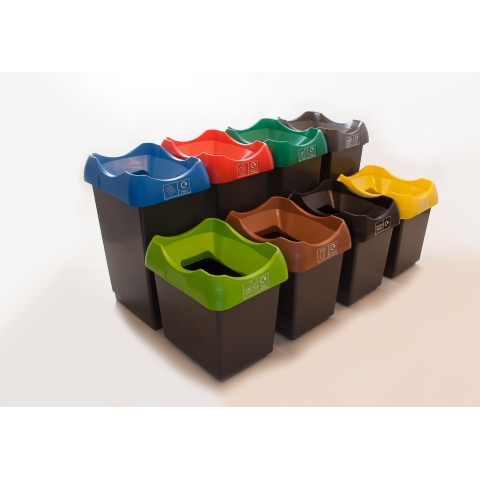
Where is `tall recycling bin`? This screenshot has width=480, height=480. tall recycling bin is located at coordinates (186, 216), (241, 189), (295, 173), (347, 160).